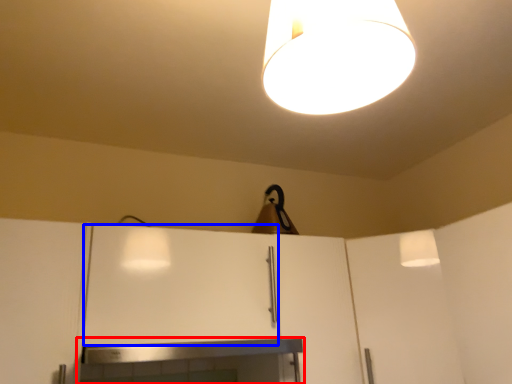
Question: Which of the following is the closest to the observer, fireplace (highlighted by a red box) or cabinetry (highlighted by a blue box)?

Choices:
 (A) fireplace
 (B) cabinetry

Answer: (A)